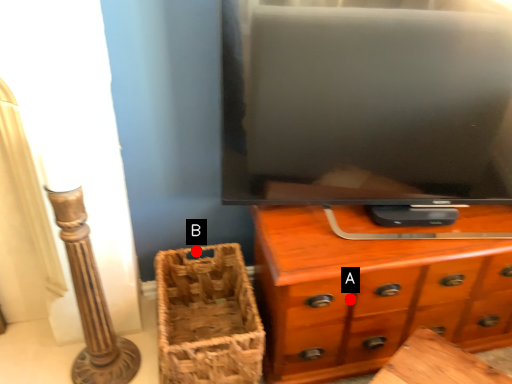
Question: Two points are circled on the image, labeled by A and B beside each circle. Which point is closer to the camera?

Choices:
 (A) A is closer
 (B) B is closer

Answer: (A)